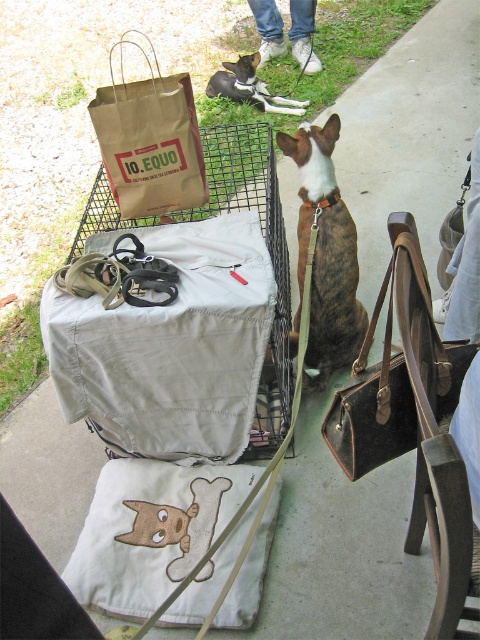
Where is the matte black leash at center located in the image?

The matte black leash at center is located at point coordinates of 0.542 on the x axis and 0.358 on the y axis.

You are a dog owner trying to determine if your dog can fit through a narrow doorway. The doorway has a width of 10 cm. Given the information about the matte black leash at center and brown leather dog at center, can the dog pass through the doorway?

The brown leather dog at center is wider than the 10 cm doorway, so the dog cannot pass through.

From the picture: You are standing in front of the portable pet carrier with the dog inside. There are two points marked on the carrier. One is at point (x=216, y=404) and the other at point (x=387, y=368). Which point is closer to you?

Point (x=216, y=404) is closer to you because it is further to the viewer than point (x=387, y=368).